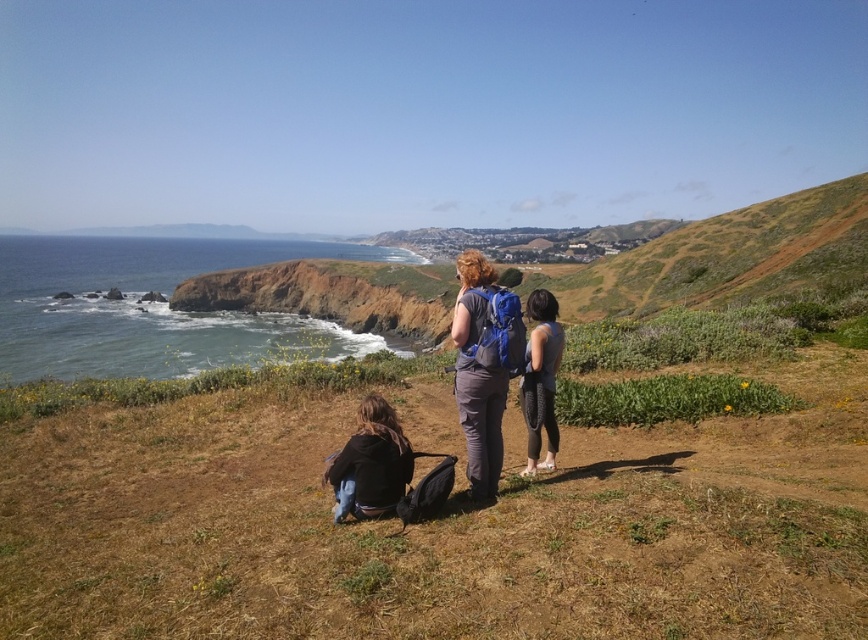
Question: Does blue water at left have a lesser width compared to matte blue backpack at center?

Choices:
 (A) no
 (B) yes

Answer: (A)

Question: Which of the following is the farthest from the observer?

Choices:
 (A) (540, 291)
 (B) (487, 456)

Answer: (A)

Question: Can you confirm if blue water at left is positioned above matte blue backpack at center?

Choices:
 (A) yes
 (B) no

Answer: (A)

Question: Does matte blue backpack at center have a greater width compared to black mesh leggings at center?

Choices:
 (A) no
 (B) yes

Answer: (B)

Question: Which point is farther to the camera?

Choices:
 (A) black mesh leggings at center
 (B) blue water at left

Answer: (B)

Question: Among these objects, which one is nearest to the camera?

Choices:
 (A) matte blue backpack at center
 (B) blue water at left

Answer: (A)